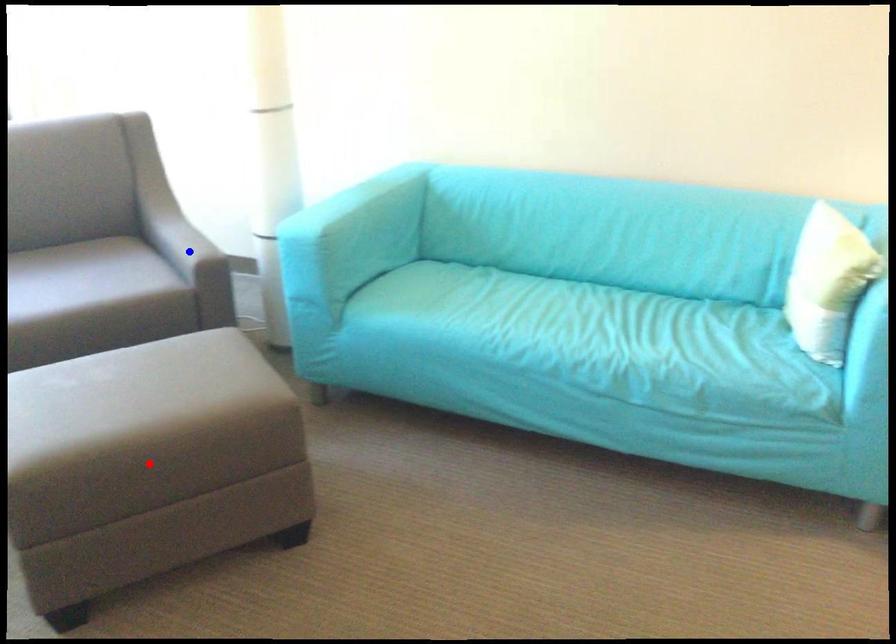
Question: Which of the two points in the image is closer to the camera?

Choices:
 (A) Blue point is closer.
 (B) Red point is closer.

Answer: (B)